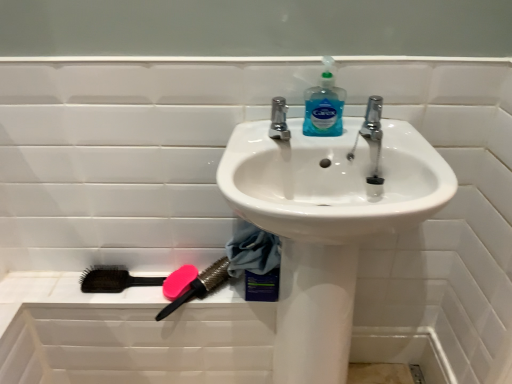
Where is `vacant region to the right of translucent plastic soap dispenser at upper center`? The width and height of the screenshot is (512, 384). vacant region to the right of translucent plastic soap dispenser at upper center is located at coordinates (382, 129).